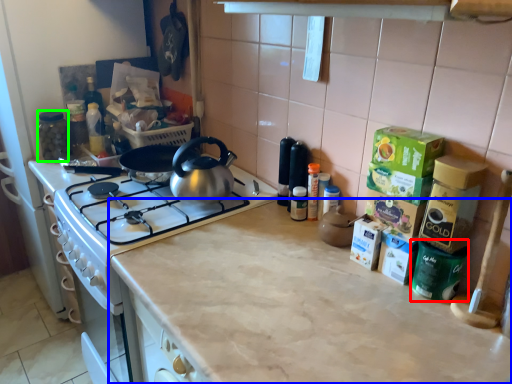
Question: Which is nearer to the appliance (highlighted by a red box)? countertop (highlighted by a blue box) or appliance (highlighted by a green box).

Choices:
 (A) countertop
 (B) appliance

Answer: (A)